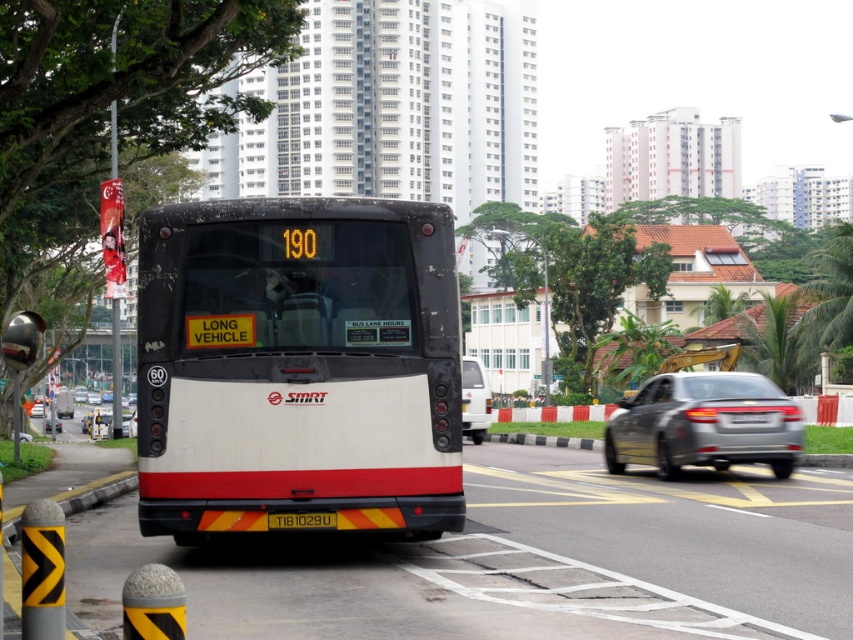
Can you confirm if silver metallic sedan at center-right is smaller than white matte van at center?

Yes.

Does silver metallic sedan at center-right have a greater height compared to white matte van at center?

In fact, silver metallic sedan at center-right may be shorter than white matte van at center.

Does point (701, 412) come farther from viewer compared to point (467, 428)?

No, it is not.

In order to click on silver metallic sedan at center-right in this screenshot , I will do `click(704, 424)`.

Is white matte van at center to the left of yellowtexturedlicense plate at center from the viewer's perspective?

In fact, white matte van at center is to the right of yellowtexturedlicense plate at center.

Can you confirm if white matte van at center is wider than yellowtexturedlicense plate at center?

Yes.

Who is more distant from viewer, (474, 388) or (289, 520)?

Point (474, 388)

You are a GUI agent. You are given a task and a screenshot of the screen. Output one action in this format:
    pyautogui.click(x=<x>, y=<y>)
    Task: Click on the white matte van at center
    The height and width of the screenshot is (640, 853).
    Given the screenshot: What is the action you would take?
    pyautogui.click(x=474, y=400)

Who is higher up, white matte bus at center or silver metallic sedan at center-right?

white matte bus at center

Is white matte bus at center thinner than silver metallic sedan at center-right?

Incorrect, white matte bus at center's width is not less than silver metallic sedan at center-right's.

Is point (169, 387) positioned behind point (657, 436)?

That is False.

At what (x,y) coordinates should I click in order to perform the action: click on white matte bus at center. Please return your answer as a coordinate pair (x, y). Looking at the image, I should click on (299, 365).